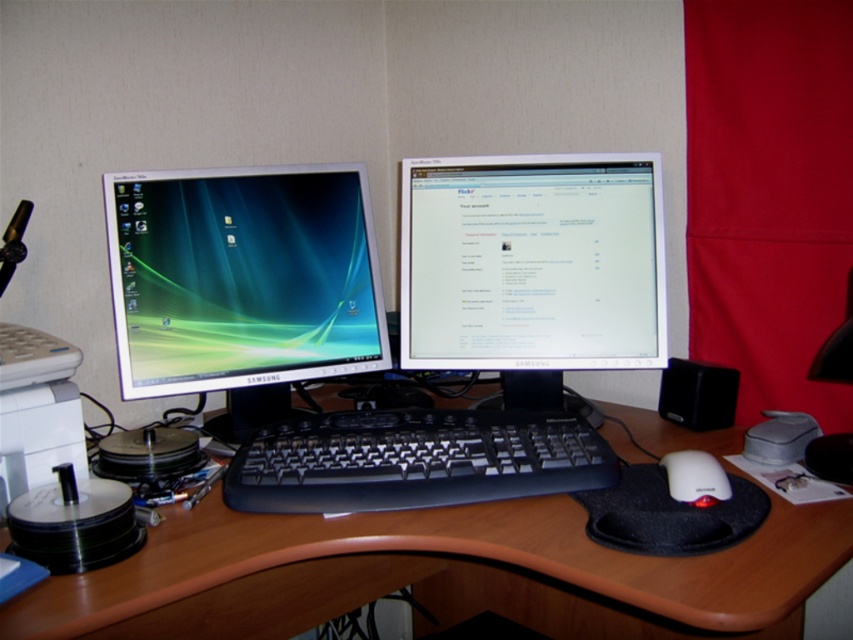
Is brown wood computer desk at center behind black plastic keyboard at center?

No, it is in front of black plastic keyboard at center.

Is brown wood computer desk at center above black plastic keyboard at center?

Actually, brown wood computer desk at center is below black plastic keyboard at center.

Between point (260, 525) and point (503, 458), which one is positioned in front?

Point (260, 525) is in front.

The height and width of the screenshot is (640, 853). In order to click on brown wood computer desk at center in this screenshot , I will do `click(438, 573)`.

Is black plastic keyboard at center above white matte mouse at lower right?

Correct, black plastic keyboard at center is located above white matte mouse at lower right.

Where is `black plastic keyboard at center`? The height and width of the screenshot is (640, 853). black plastic keyboard at center is located at coordinates (415, 460).

What are the coordinates of `black plastic keyboard at center` in the screenshot? It's located at (415, 460).

Describe the element at coordinates (532, 262) in the screenshot. This screenshot has width=853, height=640. I see `white glossy monitor at center` at that location.

Can you confirm if white glossy monitor at center is positioned below black plastic keyboard at center?

No, white glossy monitor at center is not below black plastic keyboard at center.

Is point (596, 272) behind point (469, 484)?

Yes, point (596, 272) is behind point (469, 484).

The height and width of the screenshot is (640, 853). What are the coordinates of `white glossy monitor at center` in the screenshot? It's located at coord(532,262).